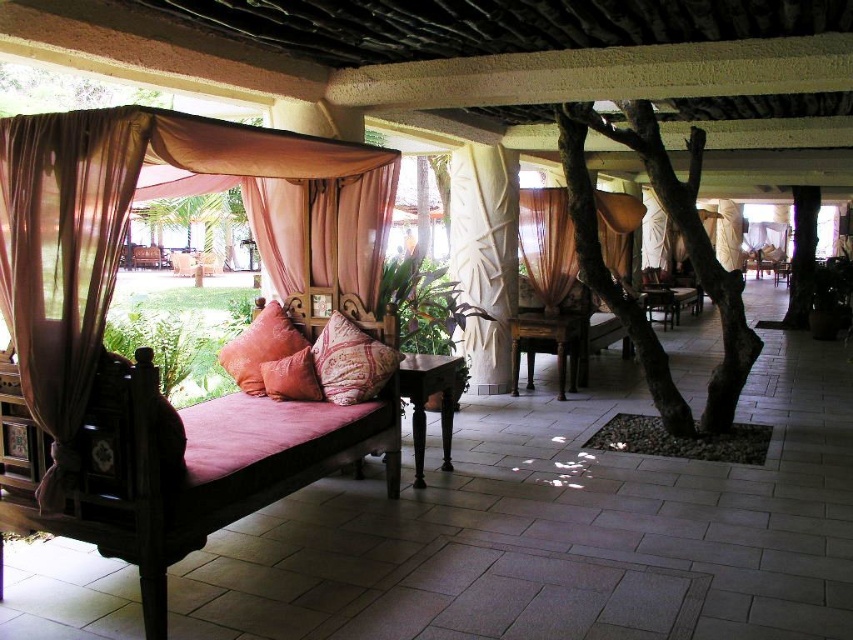
You are planning to hang a new decoration in the outdoor seating area. You have a large decorative wreath that is 1 meter in diameter. The space between the sheer beige curtain at center and the patterned fabric pillow at center is 1.2 meters. Will the wreath fit between them without overlapping?

The space between the sheer beige curtain at center and the patterned fabric pillow at center is 1.2 meters. Since the wreath is 1 meter in diameter, it will fit between them without overlapping as the available space is larger than the wreath.

You are standing at the point labeled point (259, 346). What object are you currently standing on?

The point (259, 346) is on textured orange pillow at center, so you are standing on the textured orange pillow at center.

You are sitting on the wooden bench and want to reach both the textured orange pillow at center and the rustic fabric pillow at center. Which pillow do you need to look up to touch?

The textured orange pillow at center is located above the rustic fabric pillow at center, so you need to look up to touch the textured orange pillow at center.